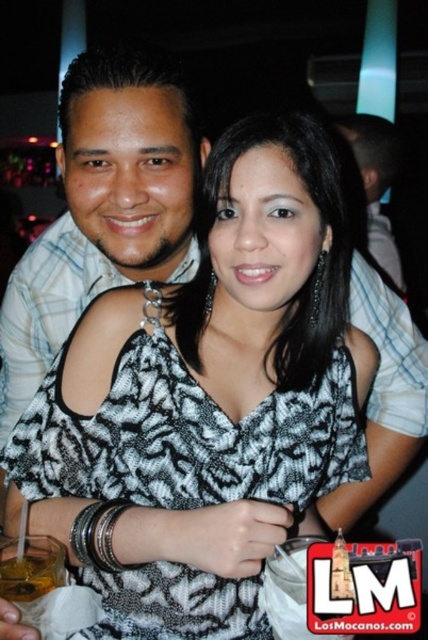
Question: Can you confirm if matte black shirt at upper center is positioned to the left of translucent plastic cup at lower left?

Choices:
 (A) yes
 (B) no

Answer: (B)

Question: Which point is closer to the camera?

Choices:
 (A) black printed fabric dress at center
 (B) matte black shirt at upper center

Answer: (A)

Question: Considering the relative positions of black printed fabric dress at center and translucent plastic cup at lower left in the image provided, where is black printed fabric dress at center located with respect to translucent plastic cup at lower left?

Choices:
 (A) left
 (B) right

Answer: (B)

Question: Can you confirm if black printed fabric dress at center is wider than translucent plastic cup at lower left?

Choices:
 (A) yes
 (B) no

Answer: (A)

Question: Which is farther from the black printed fabric dress at center?

Choices:
 (A) translucent plastic cup at lower left
 (B) matte black shirt at upper center

Answer: (B)

Question: Considering the real-world distances, which object is farthest from the matte black shirt at upper center?

Choices:
 (A) black printed fabric dress at center
 (B) translucent plastic cup at lower left

Answer: (B)